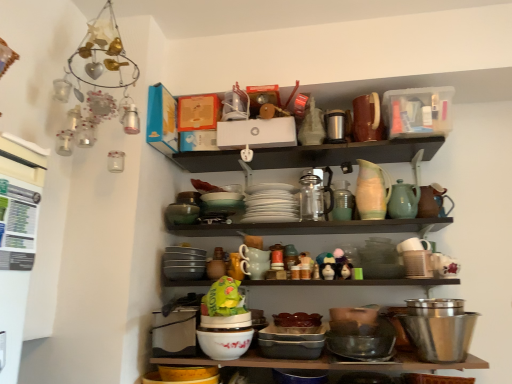
Question: From a real-world perspective, is pastel ceramic pitcher at upper center, which appears as the sixth tableware when viewed from the left, on top of stainless steel bowl at lower right, which is the 1th bowl from right to left?

Choices:
 (A) yes
 (B) no

Answer: (A)

Question: Is pastel ceramic pitcher at upper center, which appears as the sixth tableware when viewed from the left, closer to the viewer compared to stainless steel bowl at lower right, which is the 3th bowl from left to right?

Choices:
 (A) no
 (B) yes

Answer: (A)

Question: Is pastel ceramic pitcher at upper center, which appears as the second tableware when viewed from the right, to the left of stainless steel bowl at lower right, which is the 3th bowl from left to right, from the viewer's perspective?

Choices:
 (A) no
 (B) yes

Answer: (B)

Question: Is pastel ceramic pitcher at upper center, which appears as the sixth tableware when viewed from the left, touching stainless steel bowl at lower right, which is the 3th bowl from left to right?

Choices:
 (A) no
 (B) yes

Answer: (A)

Question: Is pastel ceramic pitcher at upper center, which appears as the second tableware when viewed from the right, taller than stainless steel bowl at lower right, which is the 3th bowl from left to right?

Choices:
 (A) no
 (B) yes

Answer: (B)

Question: Is pastel ceramic pitcher at upper center, which appears as the sixth tableware when viewed from the left, not close to stainless steel bowl at lower right, which is the 3th bowl from left to right?

Choices:
 (A) yes
 (B) no

Answer: (B)

Question: Does green glass jar at center, the fifth tableware in the left-to-right sequence, have a greater height compared to metallic thermos at upper center, acting as the 4th tableware starting from the right?

Choices:
 (A) yes
 (B) no

Answer: (A)

Question: Is green glass jar at center, which is counted as the third tableware, starting from the right, located outside metallic thermos at upper center, acting as the 4th tableware starting from the right?

Choices:
 (A) yes
 (B) no

Answer: (A)

Question: Is green glass jar at center, the fifth tableware in the left-to-right sequence, further to camera compared to metallic thermos at upper center, arranged as the fourth tableware when viewed from the left?

Choices:
 (A) yes
 (B) no

Answer: (B)

Question: Is green glass jar at center, which is counted as the third tableware, starting from the right, positioned far away from metallic thermos at upper center, acting as the 4th tableware starting from the right?

Choices:
 (A) no
 (B) yes

Answer: (A)

Question: Considering the relative sizes of green glass jar at center, which is counted as the third tableware, starting from the right, and metallic thermos at upper center, acting as the 4th tableware starting from the right, in the image provided, is green glass jar at center, which is counted as the third tableware, starting from the right, wider than metallic thermos at upper center, acting as the 4th tableware starting from the right,?

Choices:
 (A) yes
 (B) no

Answer: (B)

Question: From a real-world perspective, is green glass jar at center, the fifth tableware in the left-to-right sequence, physically below metallic thermos at upper center, acting as the 4th tableware starting from the right?

Choices:
 (A) yes
 (B) no

Answer: (A)

Question: Is metallic thermos at upper center, arranged as the fourth tableware when viewed from the left, positioned with its back to matte ceramic dishes at center, the first shelf when ordered from bottom to top?

Choices:
 (A) yes
 (B) no

Answer: (B)